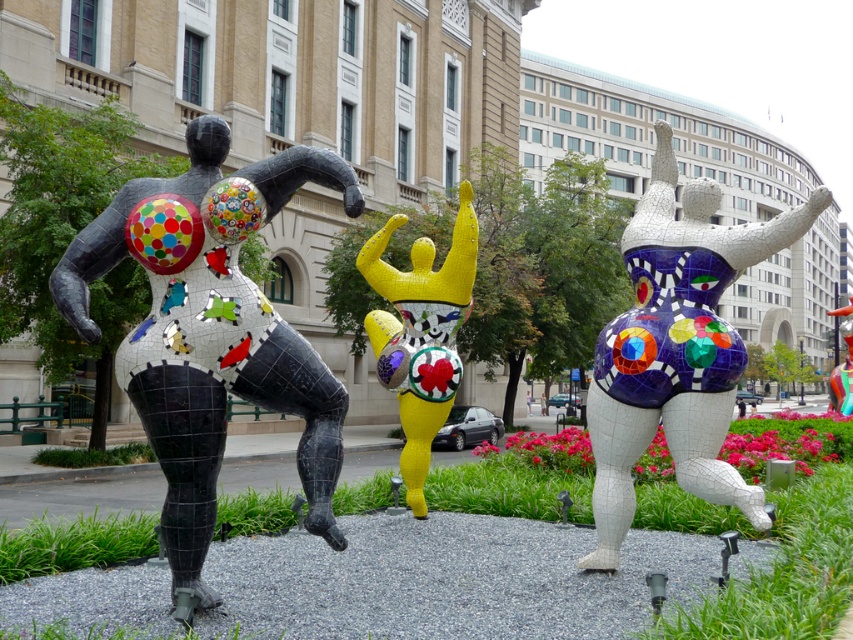
Question: Considering the relative positions of crackle-glazed ceramic sculpture at center and shiny yellow mosaic figure at center in the image provided, where is crackle-glazed ceramic sculpture at center located with respect to shiny yellow mosaic figure at center?

Choices:
 (A) right
 (B) left

Answer: (A)

Question: In this image, where is black mosaic figure at left located relative to shiny yellow mosaic figure at center?

Choices:
 (A) left
 (B) right

Answer: (A)

Question: Estimate the real-world distances between objects in this image. Which object is farther from the black mosaic figure at left?

Choices:
 (A) crackle-glazed ceramic sculpture at center
 (B) shiny yellow mosaic figure at center

Answer: (B)

Question: Among these points, which one is farthest from the camera?

Choices:
 (A) (210, 147)
 (B) (421, 364)
 (C) (699, 356)

Answer: (B)

Question: Which point appears farthest from the camera in this image?

Choices:
 (A) (422, 368)
 (B) (712, 362)
 (C) (254, 310)

Answer: (A)

Question: Where is black mosaic figure at left located in relation to crackle-glazed ceramic sculpture at center in the image?

Choices:
 (A) right
 (B) left

Answer: (B)